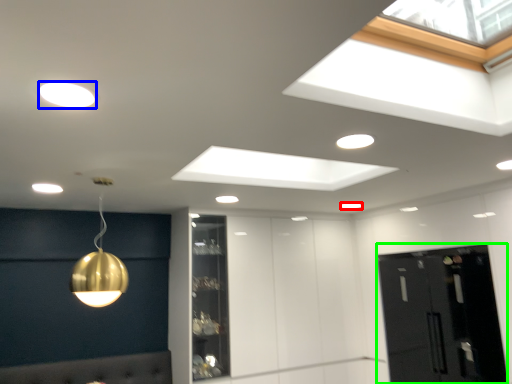
Question: Which is farther away from lamp (highlighted by a red box)? lamp (highlighted by a blue box) or glass door (highlighted by a green box)?

Choices:
 (A) lamp
 (B) glass door

Answer: (A)